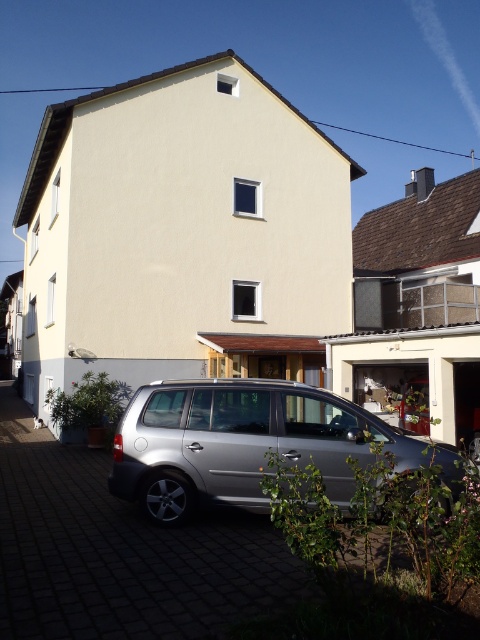
Can you confirm if silver metallic car at lower center is shorter than satin silver van at lower center?

Yes.

Which is behind, point (28, 625) or point (417, 452)?

The point (417, 452) is behind.

The image size is (480, 640). Identify the location of silver metallic car at lower center. (118, 552).